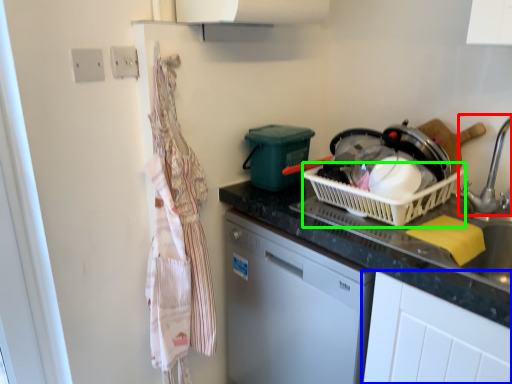
Question: Considering the real-world distances, which object is closest to faucet (highlighted by a red box)? cabinetry (highlighted by a blue box) or basket (highlighted by a green box).

Choices:
 (A) cabinetry
 (B) basket

Answer: (B)